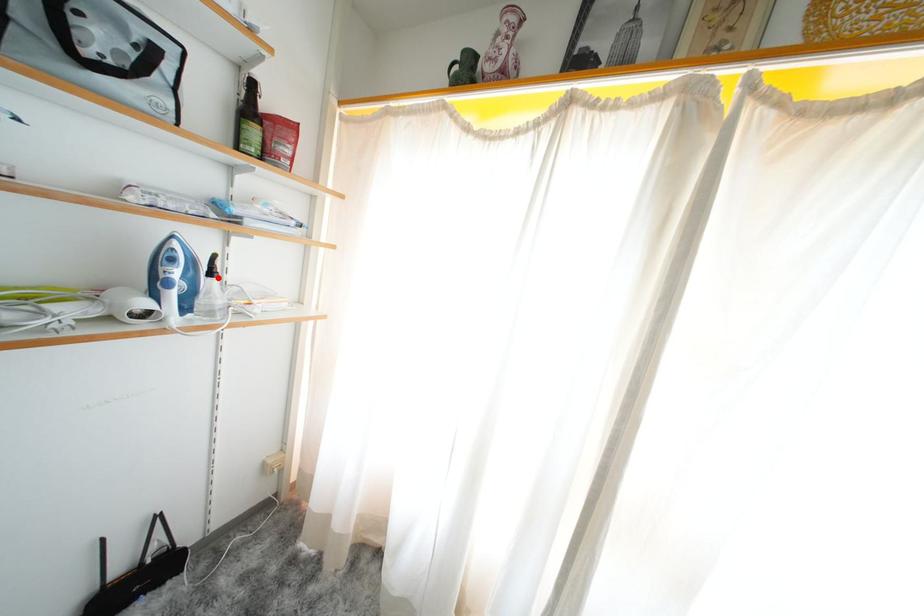
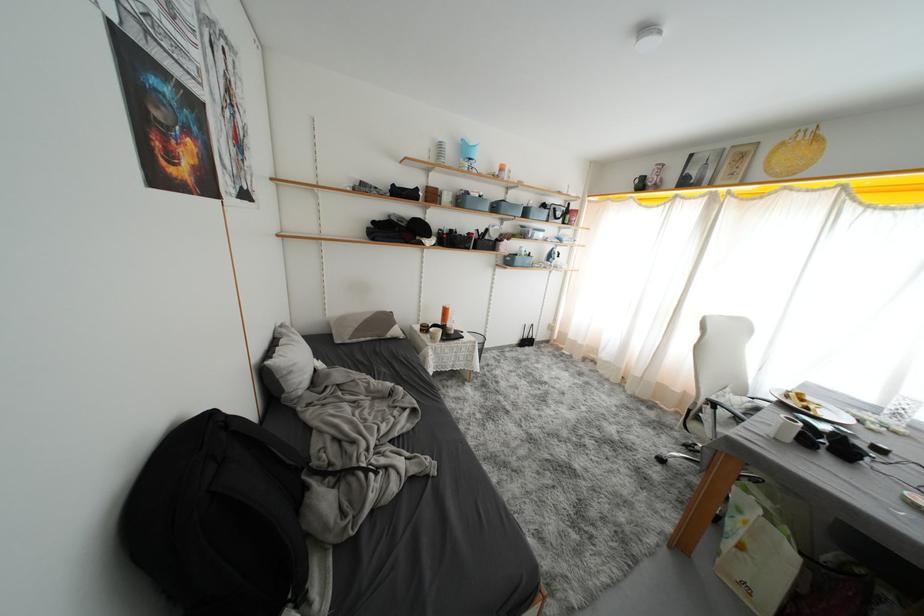
Question: I am providing you with two images of the same scene from different viewpoints. A red point is marked on the first image. Can you still see the location of the red point in image 2?

Choices:
 (A) Yes
 (B) No

Answer: (B)